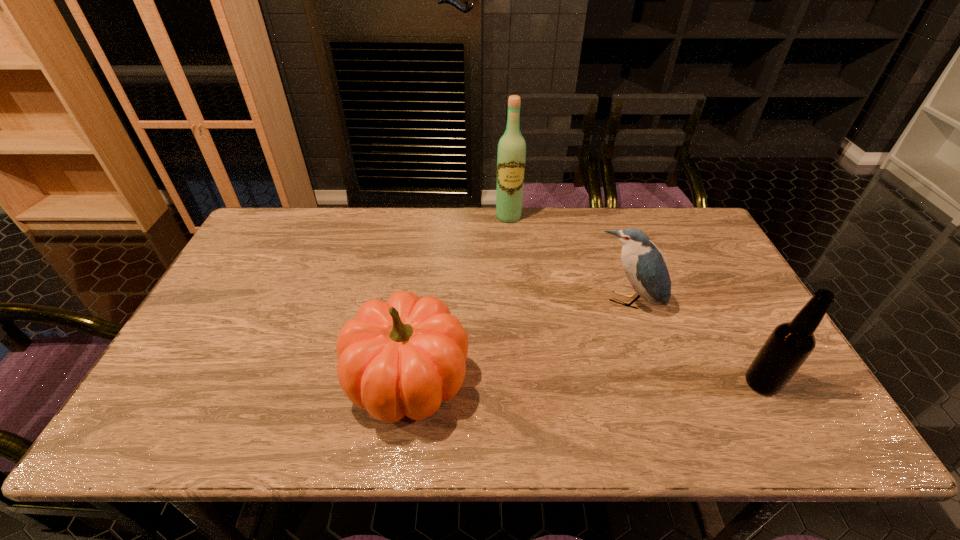
Where is `vacant space on the desktop that is between the leftmost object and the rightmost object and is positioned at the tip of the second farthest object's beak`? Image resolution: width=960 pixels, height=540 pixels. vacant space on the desktop that is between the leftmost object and the rightmost object and is positioned at the tip of the second farthest object's beak is located at coordinates (602, 382).

In order to click on vacant spot on the desktop that is between the leftmost object and the rightmost object and is positioned on the front-facing side of the second object from left to right in this screenshot , I will do `click(534, 381)`.